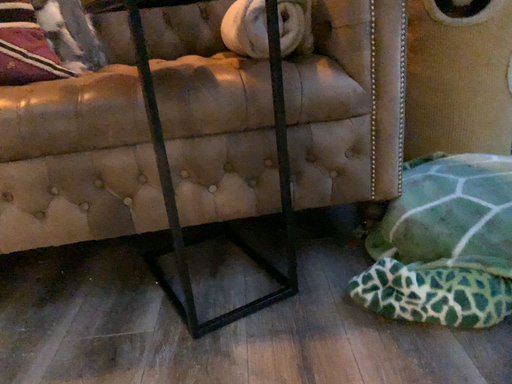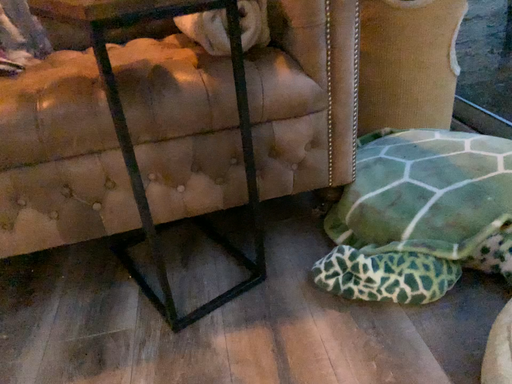
Question: Which way did the camera rotate in the video?

Choices:
 (A) rotated left
 (B) rotated right

Answer: (B)